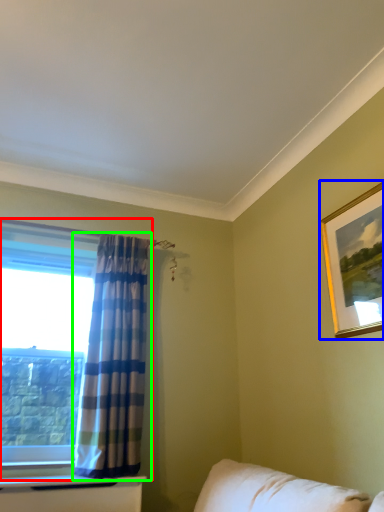
Question: Which is nearer to the window (highlighted by a red box)? picture frame (highlighted by a blue box) or curtain (highlighted by a green box).

Choices:
 (A) picture frame
 (B) curtain

Answer: (B)